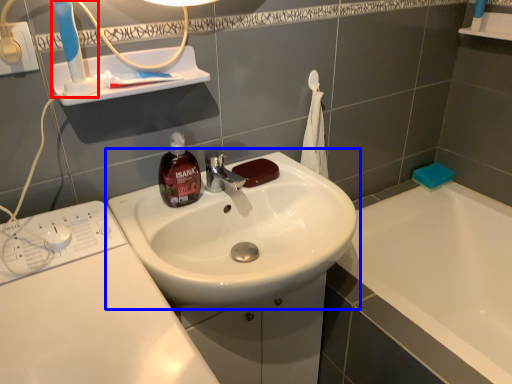
Question: Which of the following is the farthest to the observer, toothbrush (highlighted by a red box) or sink (highlighted by a blue box)?

Choices:
 (A) toothbrush
 (B) sink

Answer: (B)